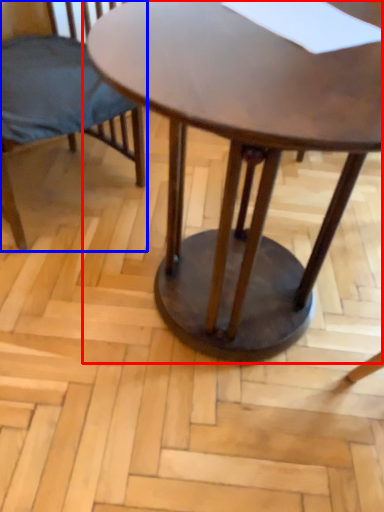
Question: Which object appears farthest to the camera in this image, coffee table (highlighted by a red box) or chair (highlighted by a blue box)?

Choices:
 (A) coffee table
 (B) chair

Answer: (B)